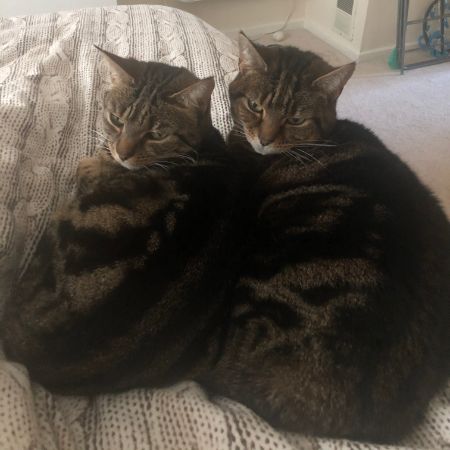
Find the location of `blanket`. blanket is located at coordinates point(55,130).